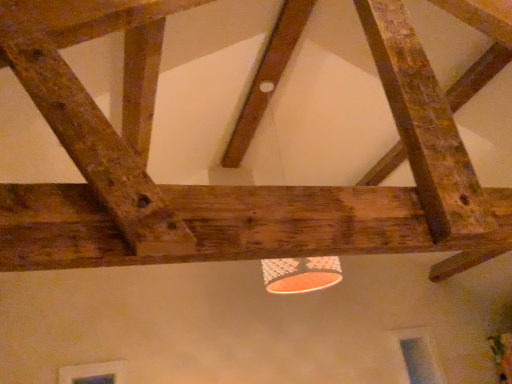
Question: Which direction should I rotate to look at rustic wood beam at upper center, positioned as the 3th plank in right-to-left order?

Choices:
 (A) left
 (B) right

Answer: (A)

Question: Is rustic wood beam at center, the 3th plank in the front-to-back sequence, taller than rustic wood beam at upper right, the second plank viewed from the back?

Choices:
 (A) no
 (B) yes

Answer: (A)

Question: Is rustic wood beam at center, the 2th plank positioned from the left, positioned with its back to rustic wood beam at upper right, the second plank viewed from the back?

Choices:
 (A) no
 (B) yes

Answer: (A)

Question: Is rustic wood beam at center, the 2th plank positioned from the left, at the right side of rustic wood beam at upper right, positioned as the 3th plank in left-to-right order?

Choices:
 (A) yes
 (B) no

Answer: (B)

Question: Does rustic wood beam at center, the 3th plank in the front-to-back sequence, have a larger size compared to rustic wood beam at upper right, marked as the 1th plank in a right-to-left arrangement?

Choices:
 (A) no
 (B) yes

Answer: (B)

Question: Is rustic wood beam at center, acting as the 1th plank starting from the back, further to camera compared to rustic wood beam at upper right, marked as the 1th plank in a right-to-left arrangement?

Choices:
 (A) no
 (B) yes

Answer: (B)

Question: Does rustic wood beam at center, the 3th plank in the front-to-back sequence, contain rustic wood beam at upper right, marked as the 1th plank in a right-to-left arrangement?

Choices:
 (A) no
 (B) yes

Answer: (A)

Question: Considering the relative positions of rustic wood beam at upper right, positioned as the 3th plank in left-to-right order, and rustic wood beam at upper center, positioned as the 3th plank in right-to-left order, in the image provided, is rustic wood beam at upper right, positioned as the 3th plank in left-to-right order, behind rustic wood beam at upper center, positioned as the 3th plank in right-to-left order,?

Choices:
 (A) yes
 (B) no

Answer: (A)

Question: Is rustic wood beam at upper right, acting as the 2th plank starting from the front, with rustic wood beam at upper center, positioned as the 3th plank in right-to-left order?

Choices:
 (A) yes
 (B) no

Answer: (B)

Question: Is rustic wood beam at upper right, acting as the 2th plank starting from the front, taller than rustic wood beam at upper center, which is the 3th plank in back-to-front order?

Choices:
 (A) no
 (B) yes

Answer: (B)

Question: From the image's perspective, is rustic wood beam at upper right, acting as the 2th plank starting from the front, beneath rustic wood beam at upper center, positioned as the 3th plank in right-to-left order?

Choices:
 (A) yes
 (B) no

Answer: (B)

Question: Is rustic wood beam at upper right, positioned as the 3th plank in left-to-right order, at the left side of rustic wood beam at upper center, the first plank positioned from the front?

Choices:
 (A) no
 (B) yes

Answer: (A)

Question: Can you confirm if rustic wood beam at upper right, marked as the 1th plank in a right-to-left arrangement, is positioned to the right of rustic wood beam at upper center, which is the first plank in left-to-right order?

Choices:
 (A) no
 (B) yes

Answer: (B)

Question: From the image's perspective, would you say rustic wood beam at upper right, acting as the 2th plank starting from the front, is shown under rustic wood beam at center, the 2th plank positioned from the left?

Choices:
 (A) no
 (B) yes

Answer: (B)